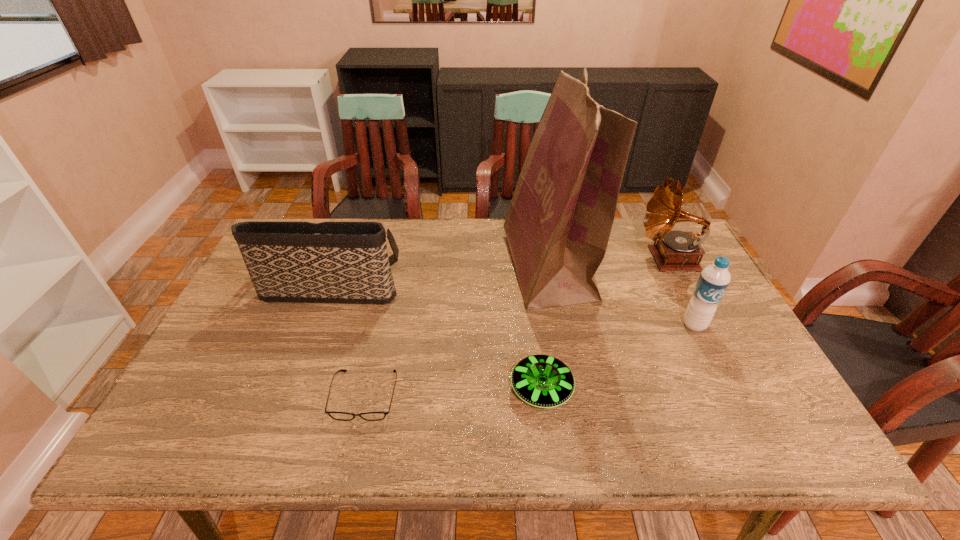
What are the coordinates of `vacant position in the image that satisfies the following two spatial constraints: 1. on the horn of the phonograph_record; 2. on the front-facing side of the shortest object` in the screenshot? It's located at (740, 395).